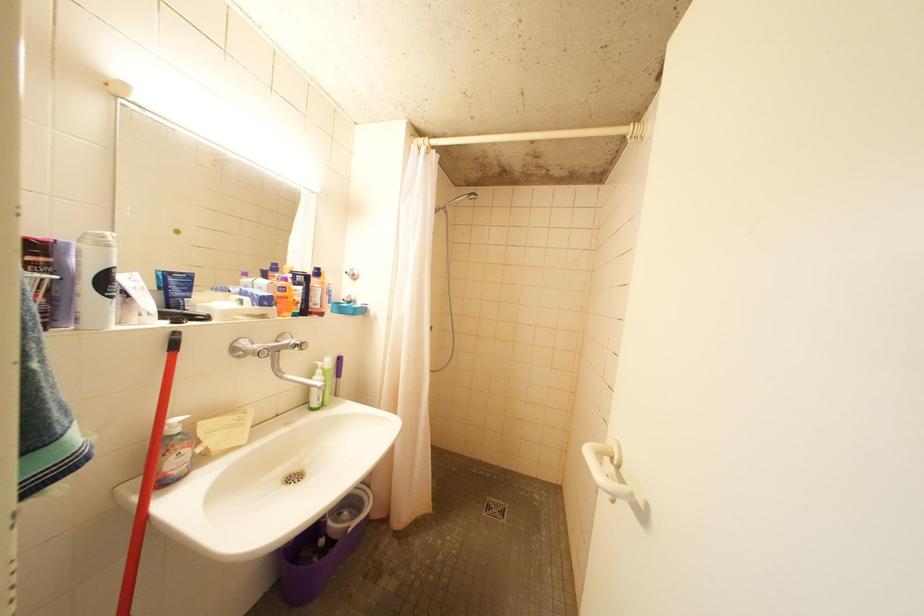
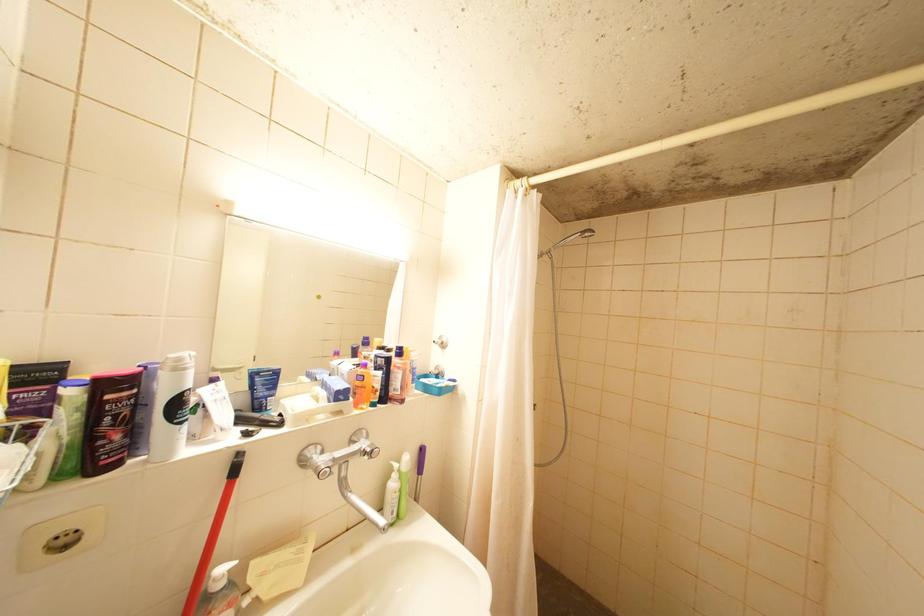
Question: The camera is either moving clockwise (left) or counter-clockwise (right) around the object. The first image is from the beginning of the video and the second image is from the end. Is the camera moving left or right when shooting the video?

Choices:
 (A) Left
 (B) Right

Answer: (B)